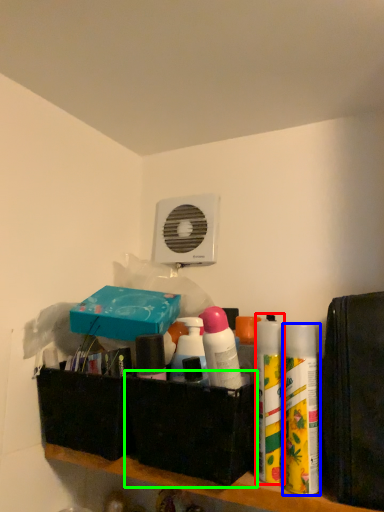
Question: Which object is the closest to the cleaning product (highlighted by a red box)? Choose among these: cleaning product (highlighted by a blue box) or box (highlighted by a green box).

Choices:
 (A) cleaning product
 (B) box

Answer: (A)